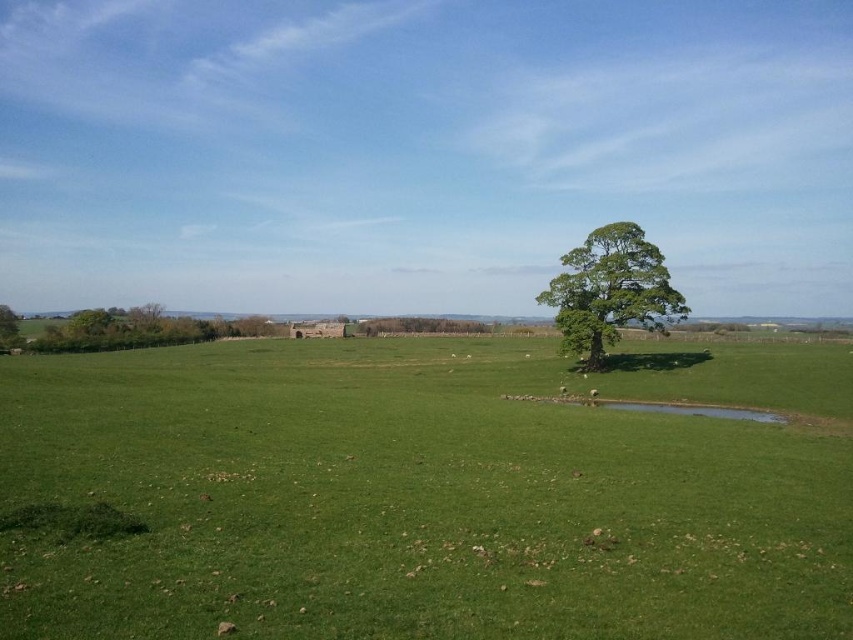
You are a farmer checking the growth of your crops. You notice the green grassy field at center and the green leafy tree at left in your field. Which one is shorter?

The green grassy field at center is shorter than the green leafy tree at left.

You are a farmer checking the layout of your land. You notice the green grassy field at center and the green leafy tree at center. Which one is positioned more towards the east if the tree is casting its shadow towards the west?

The green grassy field at center is positioned more towards the east because the tree is casting its shadow towards the west, meaning the light source is coming from the east. Since the green grassy field at center is to the left of the green leafy tree at center, and left would correspond to east if facing north, the field is east of the tree.